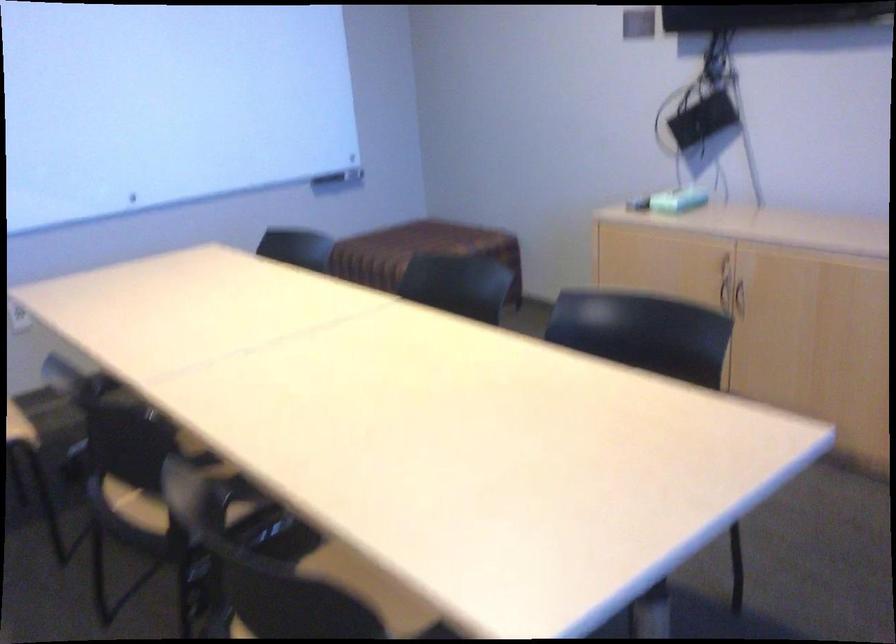
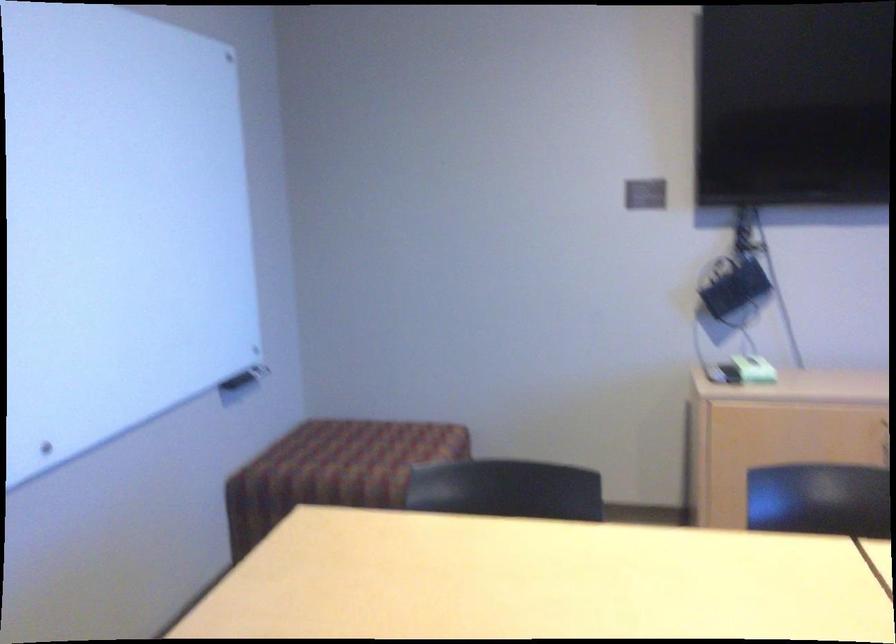
Locate, in the second image, the point that corresponds to the point at 333,169 in the first image.

(246, 373)